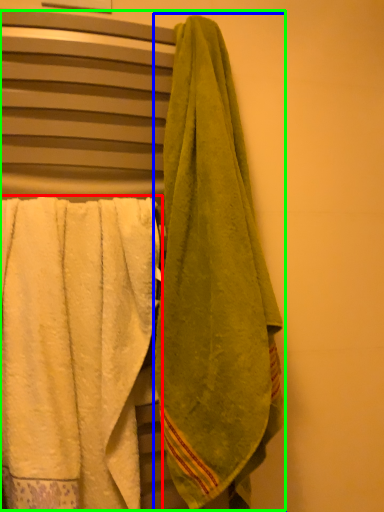
Question: Which object is the farthest from towel (highlighted by a red box)? Choose among these: towel (highlighted by a blue box) or laundry (highlighted by a green box).

Choices:
 (A) towel
 (B) laundry

Answer: (A)